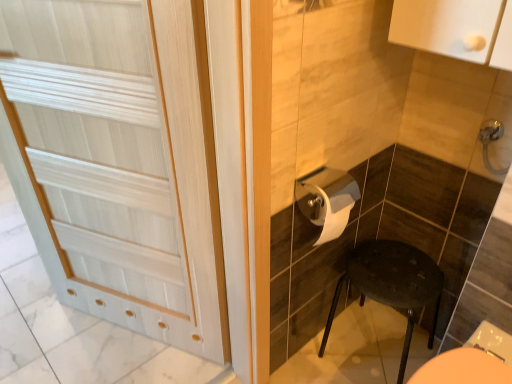
Identify the location of matte black stool at lower right. This screenshot has height=384, width=512. (392, 284).

What is the approximate height of satin nickel faucet at upper right?

satin nickel faucet at upper right is 6.46 inches tall.

Locate an element on the screen. white wood door at left is located at coordinates (118, 161).

What do you see at coordinates (327, 200) in the screenshot? I see `white glossy toilet paper at center` at bounding box center [327, 200].

At what (x,y) coordinates should I click in order to perform the action: click on matte black stool at lower right. Please return your answer as a coordinate pair (x, y). This screenshot has height=384, width=512. Looking at the image, I should click on (392, 284).

How different are the orientations of matte black stool at lower right and white wood door at left in degrees?

matte black stool at lower right and white wood door at left are facing 17 degrees away from each other.

From a real-world perspective, who is located lower, matte black stool at lower right or white wood door at left?

matte black stool at lower right, from a real-world perspective.

At what (x,y) coordinates should I click in order to perform the action: click on furniture behind the white wood door at left. Please return your answer as a coordinate pair (x, y). The image size is (512, 384). Looking at the image, I should click on (392, 284).

Considering the relative sizes of matte black stool at lower right and white wood door at left in the image provided, is matte black stool at lower right smaller than white wood door at left?

Indeed, matte black stool at lower right has a smaller size compared to white wood door at left.

In terms of size, does satin nickel faucet at upper right appear bigger or smaller than white wood door at left?

satin nickel faucet at upper right is smaller than white wood door at left.

Is satin nickel faucet at upper right taller than white wood door at left?

No, satin nickel faucet at upper right is not taller than white wood door at left.

Which is correct: satin nickel faucet at upper right is inside white wood door at left, or outside of it?

satin nickel faucet at upper right is not enclosed by white wood door at left.

Measure the distance from satin nickel faucet at upper right to white wood door at left.

satin nickel faucet at upper right is 1.13 meters from white wood door at left.

Is point (362, 291) in front of point (315, 188)?

No.

Locate an element on the screen. This screenshot has width=512, height=384. furniture below the white glossy toilet paper at center (from the image's perspective) is located at coordinates (392, 284).

Considering the positions of objects matte black stool at lower right and white glossy toilet paper at center in the image provided, who is more to the left, matte black stool at lower right or white glossy toilet paper at center?

From the viewer's perspective, white glossy toilet paper at center appears more on the left side.

Is matte black stool at lower right facing away from white glossy toilet paper at center?

No, matte black stool at lower right is not facing the opposite direction of white glossy toilet paper at center.

Can you see white wood door at left touching white glossy toilet paper at center?

No, white wood door at left is not next to white glossy toilet paper at center.

How many degrees apart are the facing directions of white wood door at left and white glossy toilet paper at center?

There is a 67.5-degree angle between the facing directions of white wood door at left and white glossy toilet paper at center.

In the scene shown: Which object is closer to the camera taking this photo, white wood door at left or white glossy toilet paper at center?

Positioned in front is white wood door at left.

Is white wood door at left not within white glossy toilet paper at center?

That's correct, white wood door at left is outside of white glossy toilet paper at center.

Looking at this image, between white glossy toilet paper at center and satin nickel faucet at upper right, which one has larger size?

Bigger between the two is white glossy toilet paper at center.

This screenshot has height=384, width=512. I want to click on toilet paper in front of the satin nickel faucet at upper right, so click(327, 200).

From a real-world perspective, is white glossy toilet paper at center physically below satin nickel faucet at upper right?

Yes, from a real-world perspective, white glossy toilet paper at center is beneath satin nickel faucet at upper right.

Considering the sizes of white glossy toilet paper at center and satin nickel faucet at upper right in the image, is white glossy toilet paper at center wider or thinner than satin nickel faucet at upper right?

white glossy toilet paper at center is wider than satin nickel faucet at upper right.

Considering the sizes of objects white glossy toilet paper at center and matte black stool at lower right in the image provided, who is bigger, white glossy toilet paper at center or matte black stool at lower right?

Bigger between the two is matte black stool at lower right.

In the scene shown: Does white glossy toilet paper at center contain matte black stool at lower right?

No, matte black stool at lower right is not inside white glossy toilet paper at center.

Is white glossy toilet paper at center far from matte black stool at lower right?

That's not correct — white glossy toilet paper at center is a little close to matte black stool at lower right.

You are a GUI agent. You are given a task and a screenshot of the screen. Output one action in this format:
    pyautogui.click(x=<x>, y=<y>)
    Task: Click on the toilet paper beneath the satin nickel faucet at upper right (from a real-world perspective)
    Image resolution: width=512 pixels, height=384 pixels.
    Given the screenshot: What is the action you would take?
    pyautogui.click(x=327, y=200)

Is satin nickel faucet at upper right closer to camera compared to white glossy toilet paper at center?

No, it is behind white glossy toilet paper at center.

Consider the image. From the image's perspective, which one is positioned lower, satin nickel faucet at upper right or white glossy toilet paper at center?

white glossy toilet paper at center.

Which of these two, satin nickel faucet at upper right or white glossy toilet paper at center, is thinner?

With smaller width is satin nickel faucet at upper right.

This screenshot has height=384, width=512. Find the location of `door in front of the matte black stool at lower right`. door in front of the matte black stool at lower right is located at coordinates (118, 161).

Locate an element on the screen. The height and width of the screenshot is (384, 512). door that appears below the satin nickel faucet at upper right (from a real-world perspective) is located at coordinates (118, 161).

When comparing their distances from white wood door at left, does matte black stool at lower right or white glossy toilet paper at center seem further?

matte black stool at lower right.

Which object lies further to the anchor point satin nickel faucet at upper right, matte black stool at lower right or white wood door at left?

white wood door at left.

Based on their spatial positions, is white wood door at left or satin nickel faucet at upper right further from white glossy toilet paper at center?

white wood door at left.

Consider the image. From the image, which object appears to be farther from satin nickel faucet at upper right, white glossy toilet paper at center or matte black stool at lower right?

matte black stool at lower right is positioned further to the anchor satin nickel faucet at upper right.

From the image, which object appears to be nearer to white wood door at left, satin nickel faucet at upper right or white glossy toilet paper at center?

white glossy toilet paper at center is positioned closer to the anchor white wood door at left.

When comparing their distances from white glossy toilet paper at center, does white wood door at left or matte black stool at lower right seem further?

white wood door at left is further to white glossy toilet paper at center.

Based on their spatial positions, is satin nickel faucet at upper right or white glossy toilet paper at center closer to matte black stool at lower right?

Among the two, white glossy toilet paper at center is located nearer to matte black stool at lower right.

Estimate the real-world distances between objects in this image. Which object is closer to white glossy toilet paper at center, satin nickel faucet at upper right or matte black stool at lower right?

The object closer to white glossy toilet paper at center is matte black stool at lower right.

Find the location of `furniture between white wood door at left and satin nickel faucet at upper right in the horizontal direction`. furniture between white wood door at left and satin nickel faucet at upper right in the horizontal direction is located at coordinates (392, 284).

The image size is (512, 384). What are the coordinates of `toilet paper situated between white wood door at left and satin nickel faucet at upper right from left to right` in the screenshot? It's located at (327, 200).

Find the location of a particular element. The width and height of the screenshot is (512, 384). toilet paper that lies between satin nickel faucet at upper right and matte black stool at lower right from top to bottom is located at coordinates (327, 200).

This screenshot has width=512, height=384. I want to click on toilet paper between white wood door at left and matte black stool at lower right, so click(x=327, y=200).